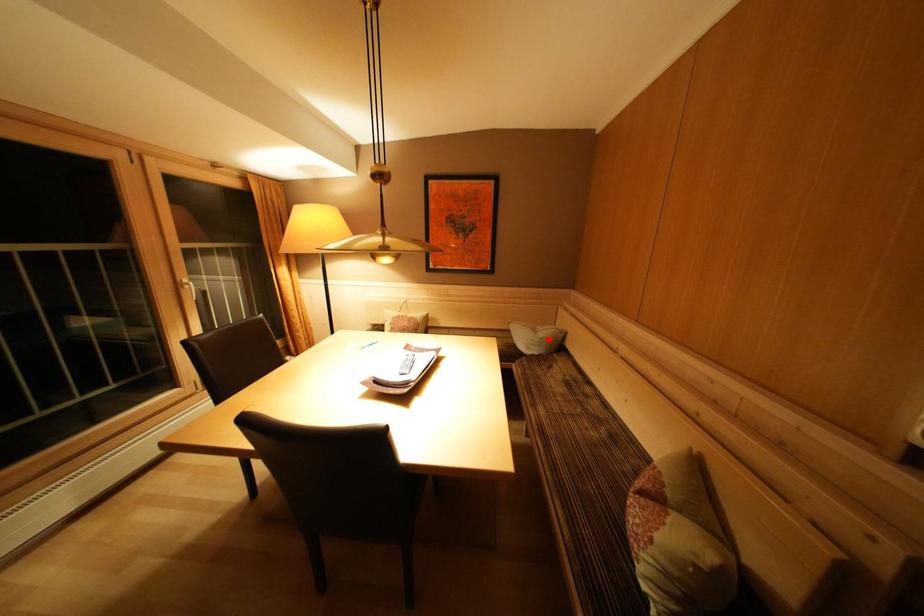
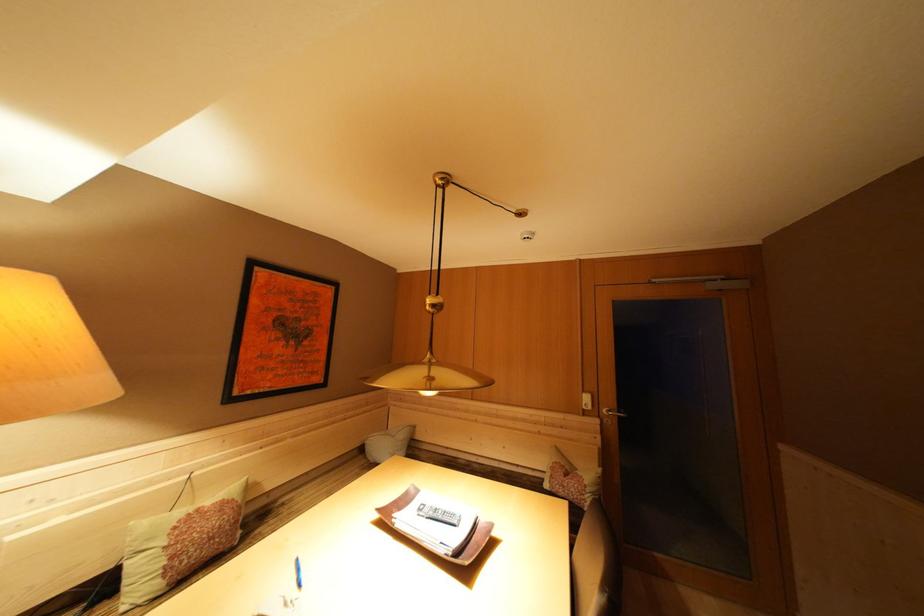
Question: I am providing you with two images of the same scene from different viewpoints. Image1 has a red point marked. In image2, the corresponding 3D location appears at what relative position? Reply with the corresponding letter.

Choices:
 (A) Closer
 (B) Farther

Answer: (B)